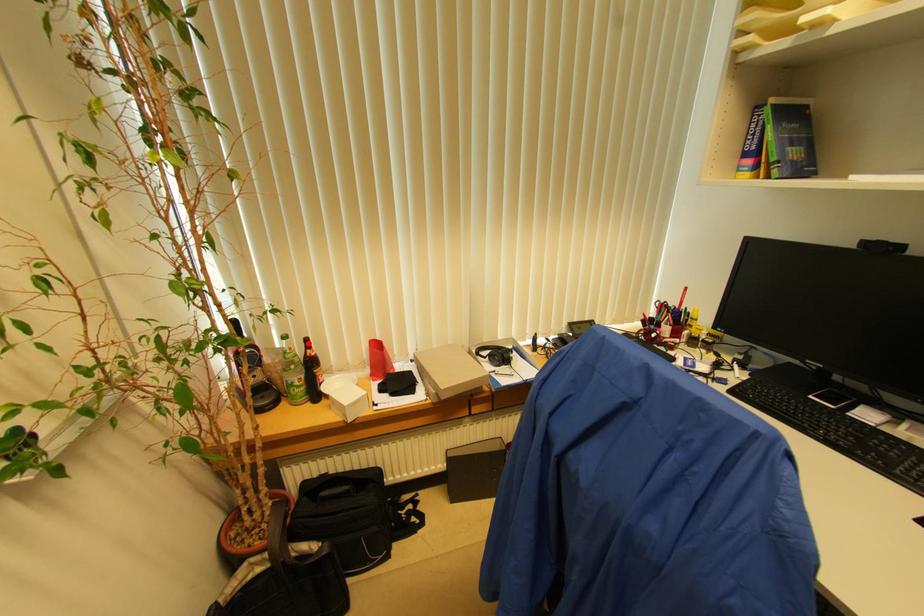
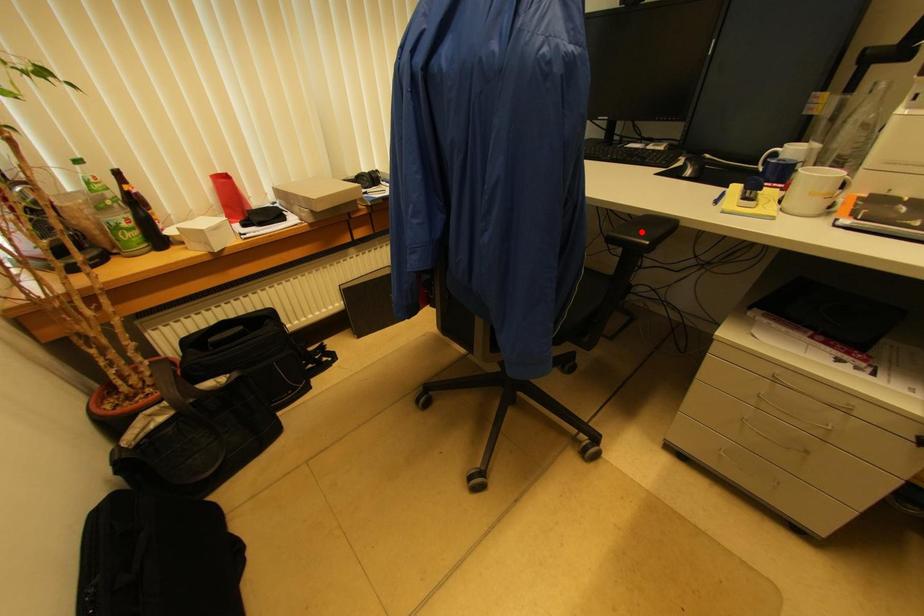
I am providing you with two images of the same scene from different viewpoints. A red point is marked on the first image and another point is marked on the second image. Do the highlighted points in image1 and image2 indicate the same real-world spot?

No